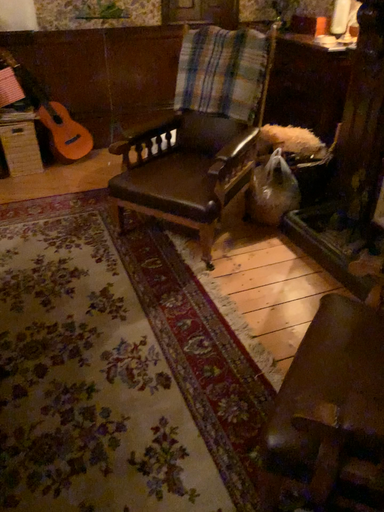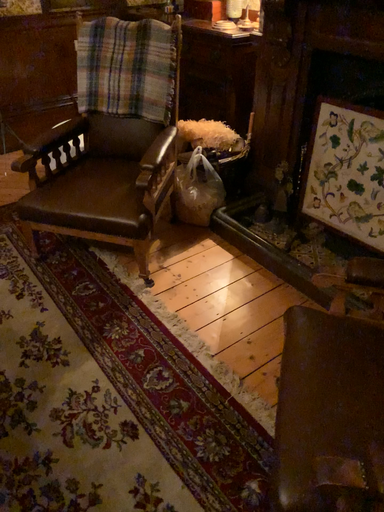
Question: How did the camera likely rotate when shooting the video?

Choices:
 (A) rotated left
 (B) rotated right

Answer: (B)